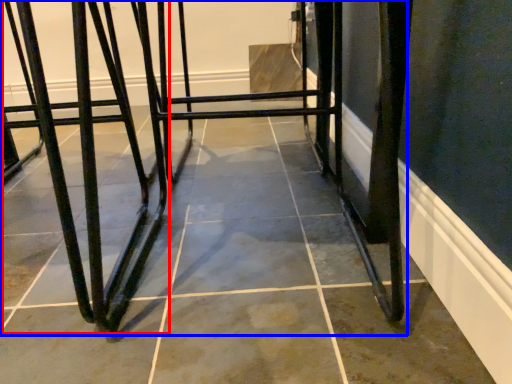
Question: Which of the following is the farthest to the observer, bar stool (highlighted by a red box) or furniture (highlighted by a blue box)?

Choices:
 (A) bar stool
 (B) furniture

Answer: (A)